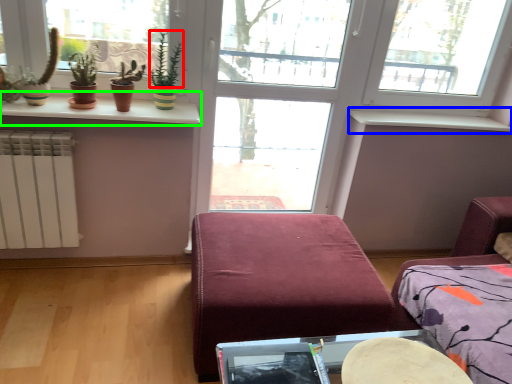
Question: Which is nearer to the plant (highlighted by a red box)? window sill (highlighted by a blue box) or window sill (highlighted by a green box).

Choices:
 (A) window sill
 (B) window sill

Answer: (B)